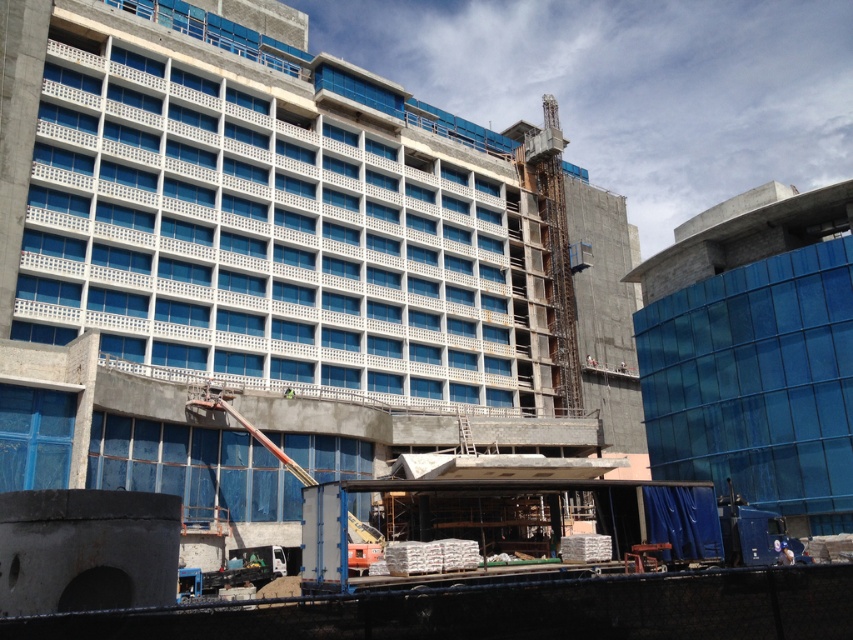
Who is lower down, concrete building at center or transparent glass building at right?

transparent glass building at right is lower down.

Does point (340, 236) come farther from viewer compared to point (701, 449)?

Yes, it is.

This screenshot has width=853, height=640. Identify the location of concrete building at center. (280, 262).